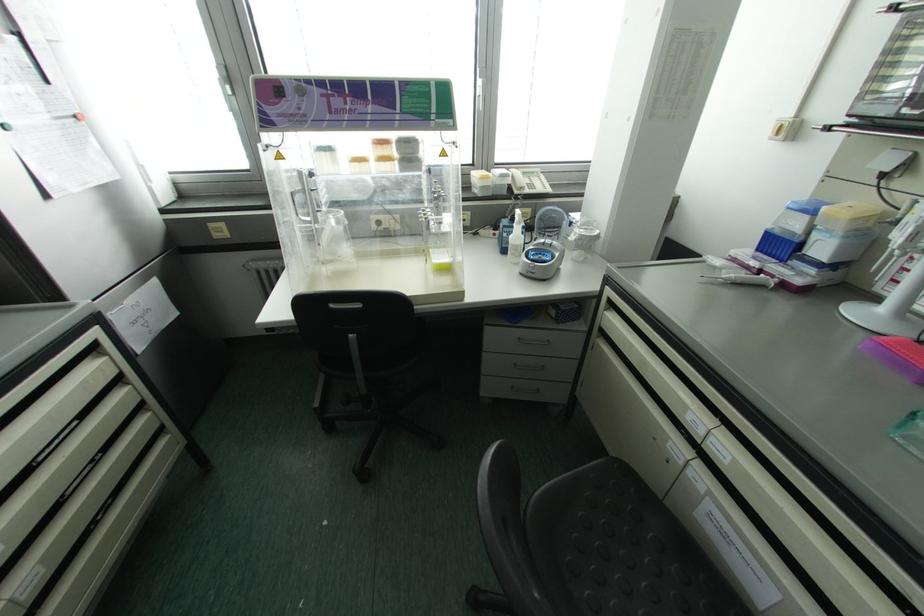
Identify the location of silver drawer handle. (532, 341).